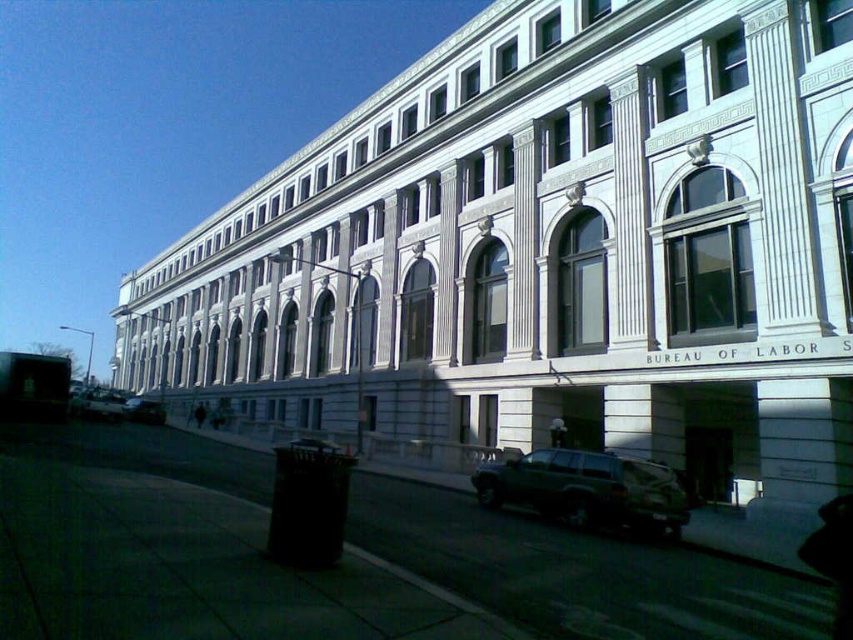
Question: Among these objects, which one is farthest from the camera?

Choices:
 (A) dark green matte suv at lower center
 (B) silver metallic suv at lower left

Answer: (B)

Question: Can you confirm if metallic silver suv at lower left is bigger than silver metallic suv at lower left?

Choices:
 (A) no
 (B) yes

Answer: (B)

Question: Does dark green matte suv at lower center appear under silver metallic suv at lower left?

Choices:
 (A) no
 (B) yes

Answer: (A)

Question: Which object is the closest to the metallic silver suv at lower left?

Choices:
 (A) silver metallic suv at lower left
 (B) dark green matte suv at lower center

Answer: (A)

Question: Among these objects, which one is farthest from the camera?

Choices:
 (A) dark green matte suv at lower center
 (B) metallic silver suv at lower left
 (C) silver metallic suv at lower left

Answer: (C)

Question: Is metallic silver suv at lower left to the right of silver metallic suv at lower left from the viewer's perspective?

Choices:
 (A) no
 (B) yes

Answer: (A)